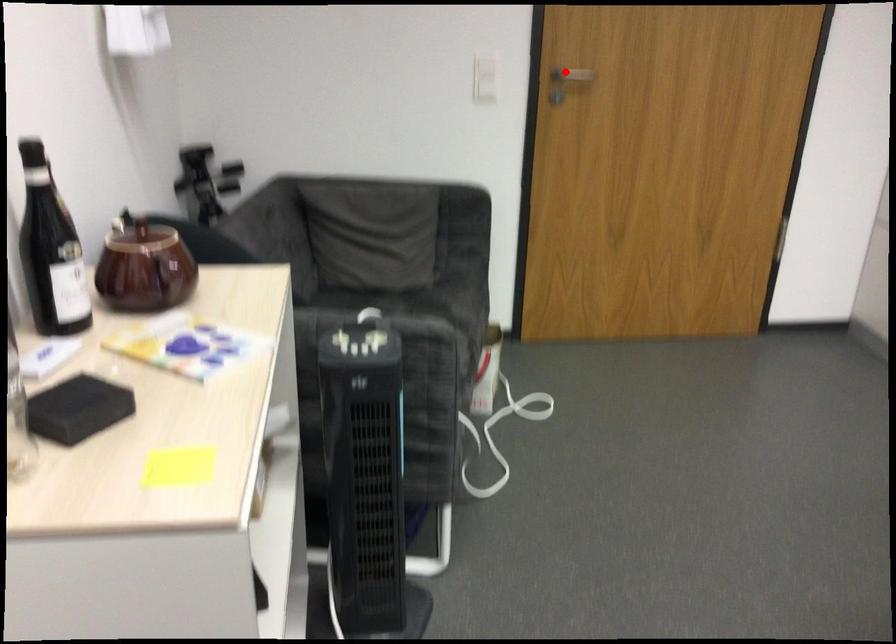
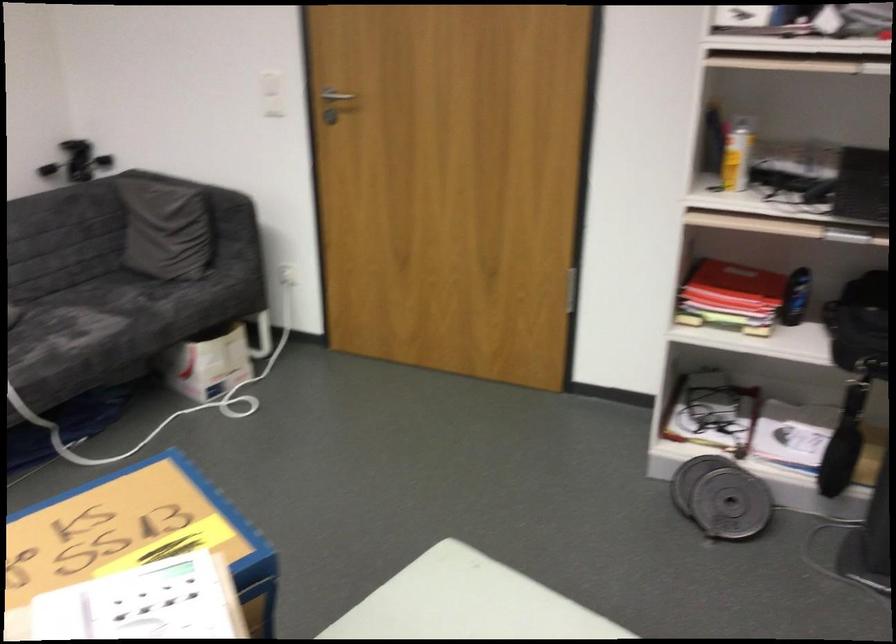
In the second image, find the point that corresponds to the highlighted location in the first image.

(331, 98)